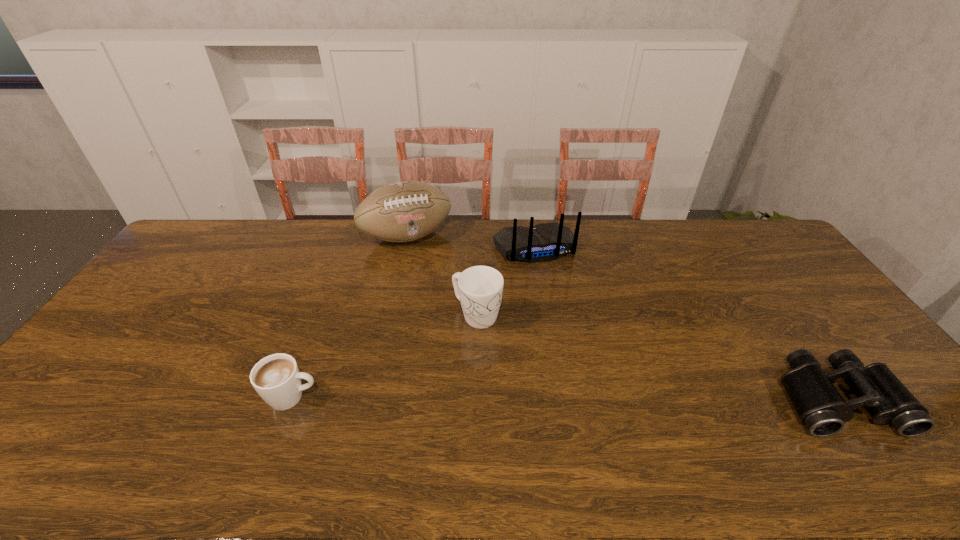
Locate an element on the screen. The width and height of the screenshot is (960, 540). free space between the cappuccino and the rightmost object is located at coordinates (564, 397).

At what (x,y) coordinates should I click in order to perform the action: click on blank region between the router and the cappuccino. Please return your answer as a coordinate pair (x, y). The width and height of the screenshot is (960, 540). Looking at the image, I should click on (413, 323).

Locate an element on the screen. empty space that is in between the football (American) and the binoculars is located at coordinates (621, 318).

Identify the location of free space between the binoculars and the router. The width and height of the screenshot is (960, 540). (684, 323).

This screenshot has height=540, width=960. Identify the location of empty space that is in between the binoculars and the mug. (657, 357).

Where is `vacant space that's between the football (American) and the rightmost object`? This screenshot has width=960, height=540. vacant space that's between the football (American) and the rightmost object is located at coordinates 621,318.

Where is `free area in between the third tallest object and the cappuccino`? free area in between the third tallest object and the cappuccino is located at coordinates (385, 356).

Select which object appears as the closest to the cappuccino. Please provide its 2D coordinates. Your answer should be formatted as a tuple, i.e. [(x, y)], where the tuple contains the x and y coordinates of a point satisfying the conditions above.

[(479, 289)]

Select which object is the third closest to the third farthest object. Please provide its 2D coordinates. Your answer should be formatted as a tuple, i.e. [(x, y)], where the tuple contains the x and y coordinates of a point satisfying the conditions above.

[(276, 378)]